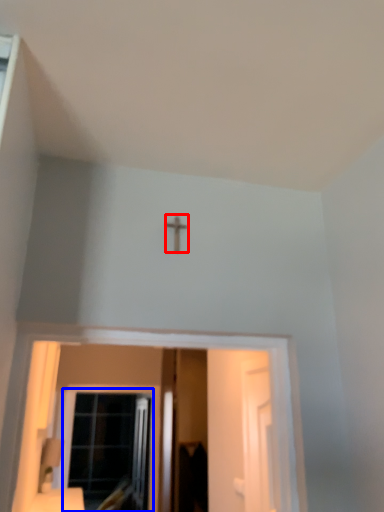
Question: Which object appears closest to the camera in this image, crucifix (highlighted by a red box) or window (highlighted by a blue box)?

Choices:
 (A) crucifix
 (B) window

Answer: (A)